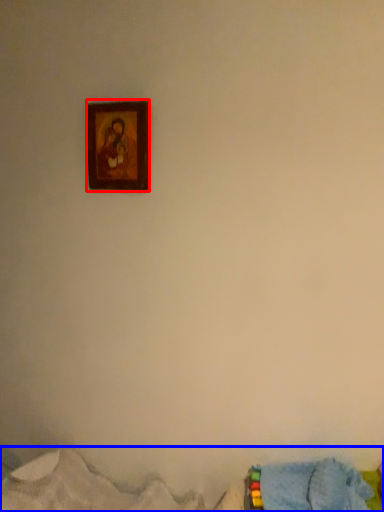
Question: Which of the following is the farthest to the observer, picture frame (highlighted by a red box) or bed (highlighted by a blue box)?

Choices:
 (A) picture frame
 (B) bed

Answer: (A)